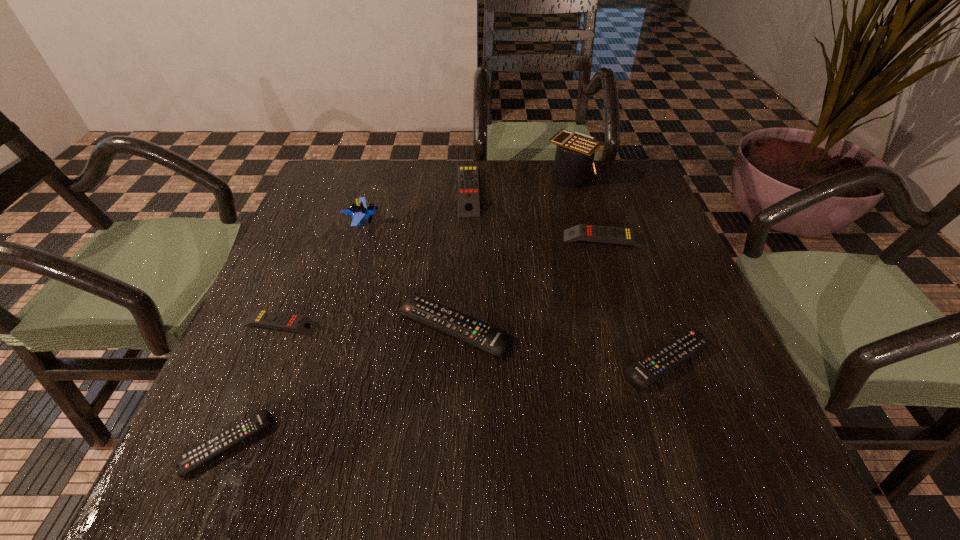
Find the location of `yellow remote control that can be found as the closest to the biggest black remote control`. yellow remote control that can be found as the closest to the biggest black remote control is located at coordinates (263, 318).

Identify which yellow remote control is the third closest to the second biggest black remote control. Please provide its 2D coordinates. Your answer should be formatted as a tuple, i.e. [(x, y)], where the tuple contains the x and y coordinates of a point satisfying the conditions above.

[(263, 318)]

This screenshot has width=960, height=540. Identify the location of black remote control that stands as the second closest to the biggest black remote control. (193, 458).

You are a GUI agent. You are given a task and a screenshot of the screen. Output one action in this format:
    pyautogui.click(x=<x>, y=<y>)
    Task: Click on the black remote control object that ranks as the closest to the leftmost yellow remote control
    
    Given the screenshot: What is the action you would take?
    pyautogui.click(x=486, y=337)